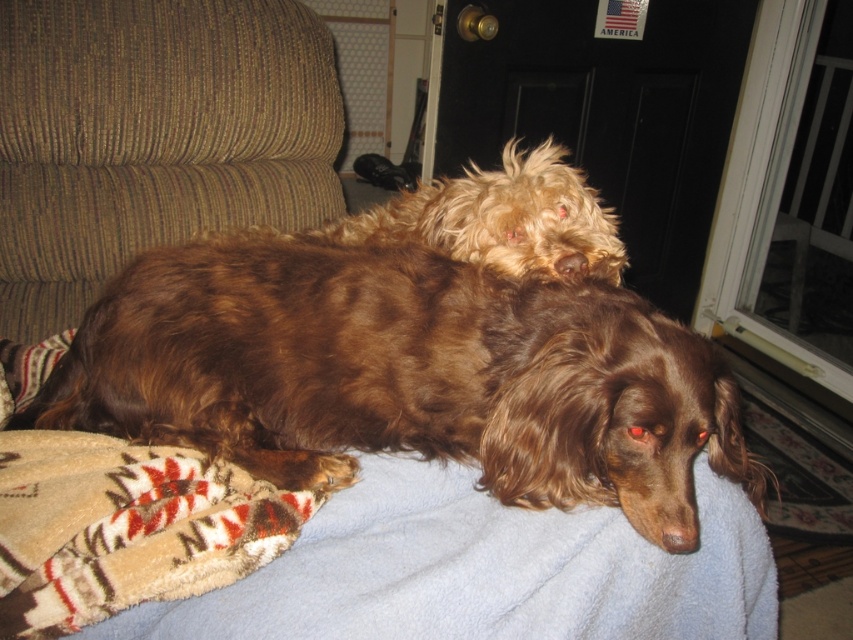
Is brown furry dog at center closer to the viewer compared to fuzzy brown dog at upper center?

Yes, brown furry dog at center is closer to the viewer.

Where is `brown furry dog at center`? This screenshot has width=853, height=640. brown furry dog at center is located at coordinates (404, 376).

Is transparent glass door at upper right positioned behind fuzzy brown dog at upper center?

Yes, transparent glass door at upper right is behind fuzzy brown dog at upper center.

Is point (727, 339) farther from camera compared to point (451, 192)?

That is True.

Where is `transparent glass door at upper right`? This screenshot has height=640, width=853. transparent glass door at upper right is located at coordinates tap(788, 221).

Find the location of `transparent glass door at upper right`. transparent glass door at upper right is located at coordinates (788, 221).

Is brown corduroy couch at upper left closer to the viewer compared to fuzzy brown dog at upper center?

No, brown corduroy couch at upper left is further to the viewer.

Is point (79, 205) farther from camera compared to point (407, 205)?

Yes, point (79, 205) is behind point (407, 205).

I want to click on brown corduroy couch at upper left, so click(152, 138).